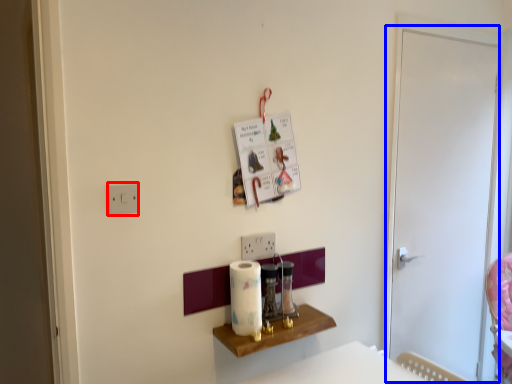
Question: Which of the following is the farthest to the observer, light switch (highlighted by a red box) or screen door (highlighted by a blue box)?

Choices:
 (A) light switch
 (B) screen door

Answer: (B)